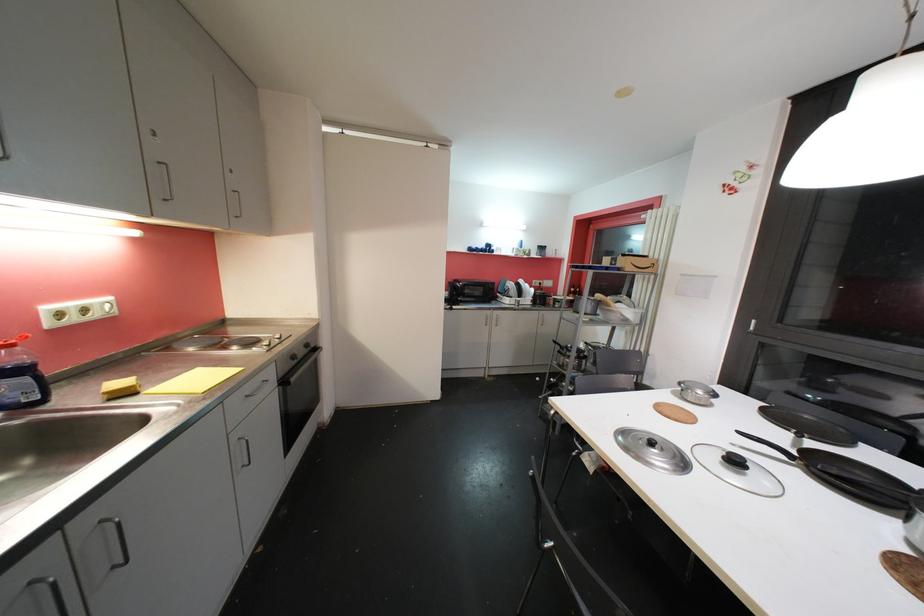
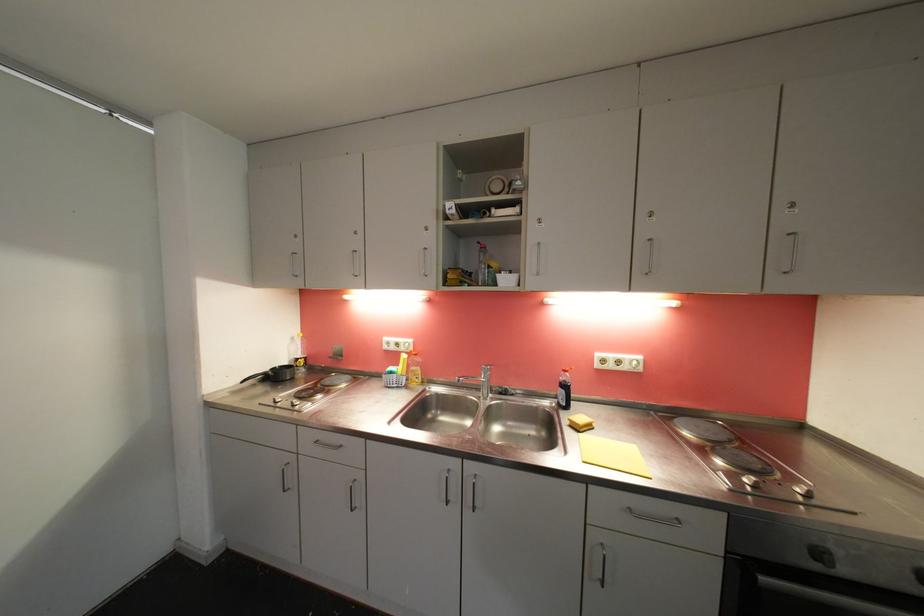
Question: The first image is from the beginning of the video and the second image is from the end. How did the camera likely rotate when shooting the video?

Choices:
 (A) Left
 (B) Right
 (C) Up
 (D) Down

Answer: (A)